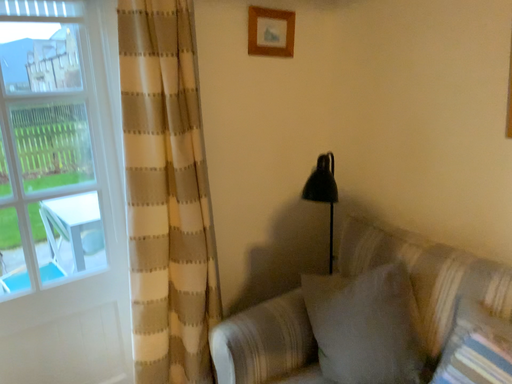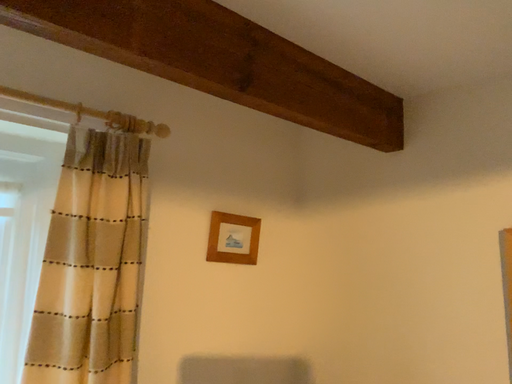
Question: How did the camera likely rotate when shooting the video?

Choices:
 (A) rotated upward
 (B) rotated downward

Answer: (A)